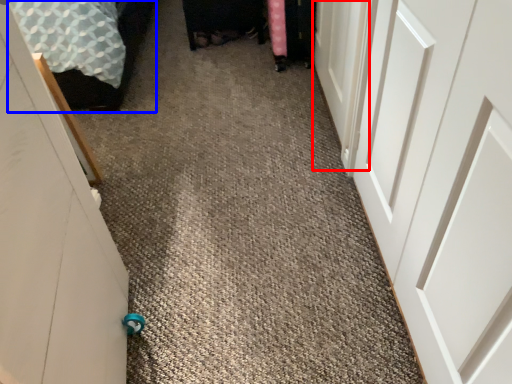
Question: Which of the following is the farthest to the observer, door (highlighted by a red box) or bed (highlighted by a blue box)?

Choices:
 (A) door
 (B) bed

Answer: (B)